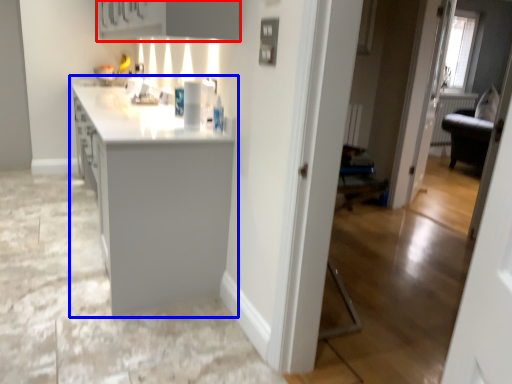
Question: Which object appears farthest to the camera in this image, cabinetry (highlighted by a red box) or countertop (highlighted by a blue box)?

Choices:
 (A) cabinetry
 (B) countertop

Answer: (B)